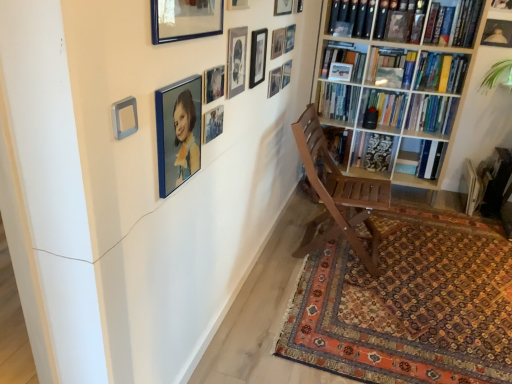
Question: Does point (204, 135) appear closer or farther from the camera than point (437, 24)?

Choices:
 (A) closer
 (B) farther

Answer: (A)

Question: Is metallic silver picture frame at upper center, positioned as the 3th picture frame in left-to-right order, inside or outside of hardcover book at upper right, arranged as the 1th book when viewed from the top?

Choices:
 (A) outside
 (B) inside

Answer: (A)

Question: Estimate the real-world distances between objects in this image. Which object is closer to the blue glossy picture frame at upper center, the thirteenth picture frame from the right?

Choices:
 (A) matte gold picture frame at upper right, the fourteenth picture frame from the left
 (B) metallic silver picture frame at upper center, placed as the fourth picture frame when sorted from left to right
 (C) hardcover book at upper right, which is the 3th book in top-to-bottom order
 (D) wooden bookcase at right
 (E) metallic silver picture frame at upper center, positioned as the 3th picture frame in left-to-right order

Answer: (B)

Question: Which of these objects is positioned closest to the blue glossy picture frame at upper center, acting as the 2th picture frame starting from the left?

Choices:
 (A) matte black picture frame at upper center, marked as the 7th picture frame in a right-to-left arrangement
 (B) matte black picture frame at upper center, placed as the seventh picture frame when sorted from left to right
 (C) metallic silver picture frame at upper center, arranged as the 13th picture frame when viewed from the left
 (D) matte black picture frame at upper center, which ranks as the 9th picture frame in right-to-left order
 (E) hardcover book at upper right, arranged as the fourth book when ordered from the bottom

Answer: (D)